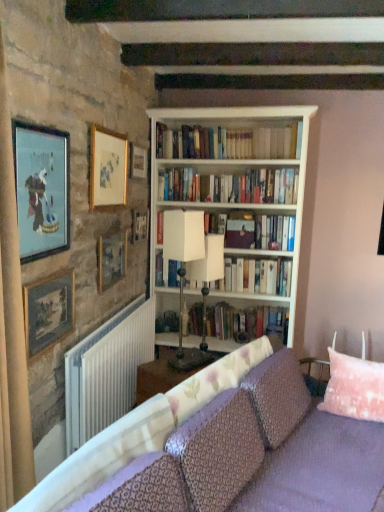
Question: Can you confirm if white wooden bookcase at center is taller than gold-framed picture at upper left, positioned as the 4th picture frame in back-to-front order?

Choices:
 (A) no
 (B) yes

Answer: (B)

Question: Is white wooden bookcase at center outside of gold-framed picture at upper left, positioned as the 4th picture frame in back-to-front order?

Choices:
 (A) no
 (B) yes

Answer: (B)

Question: Is white wooden bookcase at center further to camera compared to gold-framed picture at upper left, which ranks as the third picture frame in front-to-back order?

Choices:
 (A) yes
 (B) no

Answer: (A)

Question: Can you confirm if white wooden bookcase at center is bigger than gold-framed picture at upper left, positioned as the 4th picture frame in back-to-front order?

Choices:
 (A) yes
 (B) no

Answer: (A)

Question: From the image's perspective, would you say white wooden bookcase at center is shown under gold-framed picture at upper left, positioned as the 4th picture frame in back-to-front order?

Choices:
 (A) no
 (B) yes

Answer: (B)

Question: Would you consider white wooden bookcase at center to be distant from gold-framed picture at upper left, positioned as the 4th picture frame in back-to-front order?

Choices:
 (A) yes
 (B) no

Answer: (B)

Question: Is there a large distance between white paperbacks at center, the 3th book positioned from the bottom, and white paperbacks at upper center, which ranks as the 1th book in top-to-bottom order?

Choices:
 (A) no
 (B) yes

Answer: (A)

Question: Could white paperbacks at upper center, which ranks as the 1th book in top-to-bottom order, be considered to be inside white paperbacks at center, the 3th book positioned from the bottom?

Choices:
 (A) yes
 (B) no

Answer: (B)

Question: Does white paperbacks at center, the 3th book positioned from the bottom, turn towards white paperbacks at upper center, the fourth book when ordered from bottom to top?

Choices:
 (A) yes
 (B) no

Answer: (B)

Question: Is white paperbacks at center, the 3th book positioned from the bottom, behind white paperbacks at upper center, the fourth book when ordered from bottom to top?

Choices:
 (A) yes
 (B) no

Answer: (A)

Question: Is white paperbacks at center, which appears as the second book when viewed from the top, thinner than white paperbacks at upper center, the fourth book when ordered from bottom to top?

Choices:
 (A) no
 (B) yes

Answer: (B)

Question: Is white paperbacks at center, which appears as the second book when viewed from the top, next to white paperbacks at upper center, which ranks as the 1th book in top-to-bottom order, and touching it?

Choices:
 (A) no
 (B) yes

Answer: (A)

Question: Is wooden picture frame at upper center, the 6th picture frame positioned from the front, positioned with its back to white plastic radiator at lower left?

Choices:
 (A) yes
 (B) no

Answer: (B)